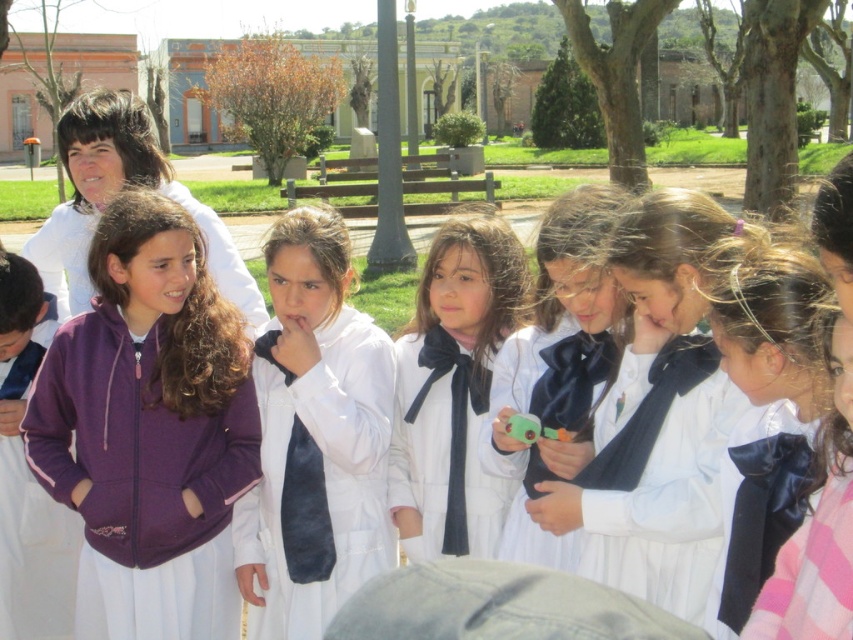
You are a photographer trying to capture a group shot of the children in the park. You notice a point at coordinates (314, 436). Which child should you focus on to ensure the white matte uniform at center is in the frame?

The point at coordinates (314, 436) represents the white matte uniform at center, so focusing on that point will ensure the white matte uniform at center is in the frame.

You are a photographer trying to capture a clear shot of the white matte uniform at center and the velvet black tie at center. Based on their positions, which one should you focus on first if you want to ensure both are in focus without adjusting the camera settings?

The white matte uniform at center is below the velvet black tie at center, so focusing on the velvet black tie at center first would allow the camera to capture the white matte uniform at center in the background naturally.